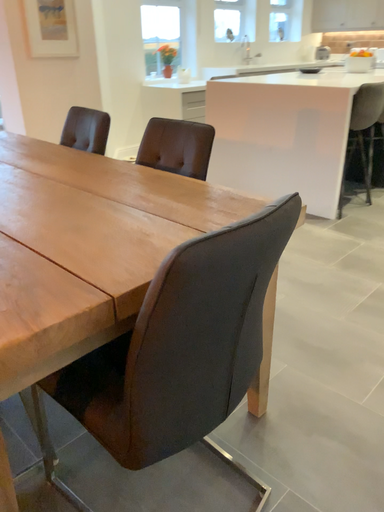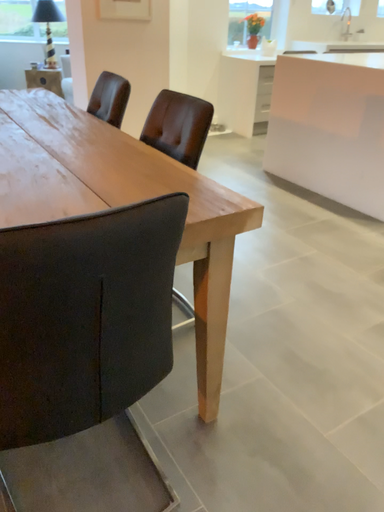
Question: Which way did the camera rotate in the video?

Choices:
 (A) rotated left
 (B) rotated right

Answer: (A)